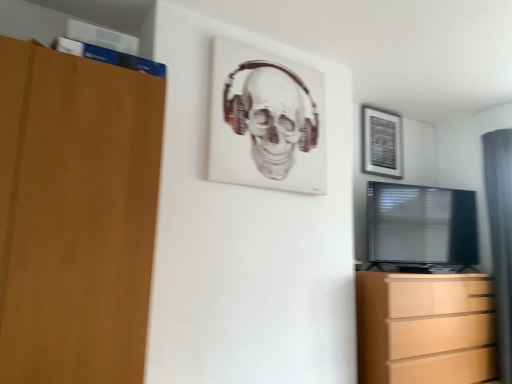
At what (x,y) coordinates should I click in order to perform the action: click on free space above white matte picture frame at upper center, the first picture frame positioned from the front (from a real-world perspective). Please return your answer as a coordinate pair (x, y). This screenshot has width=512, height=384. Looking at the image, I should click on (275, 55).